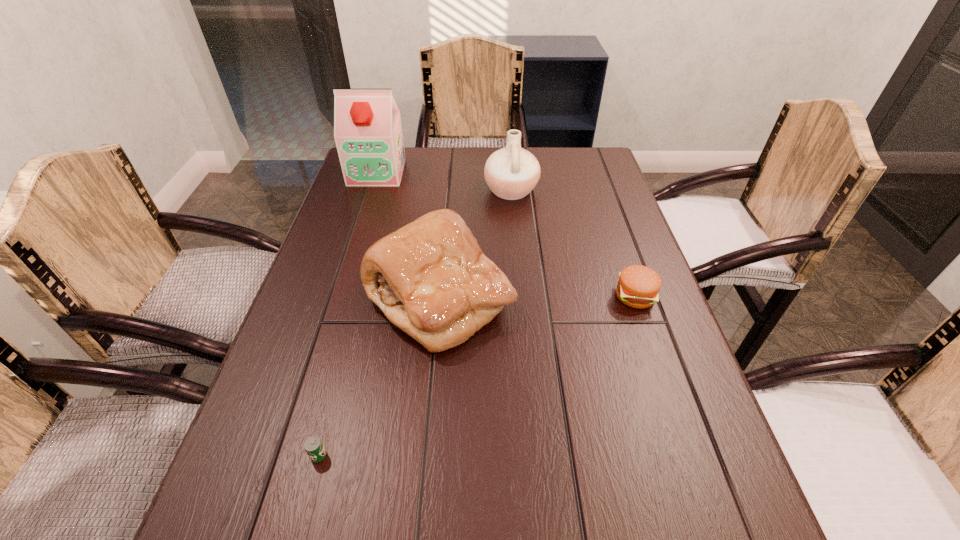
At what (x,y) coordinates should I click in order to perform the action: click on the tallest object. Please return your answer as a coordinate pair (x, y). Looking at the image, I should click on (368, 134).

What are the coordinates of `pottery` in the screenshot? It's located at (511, 173).

Locate an element on the screen. bread is located at coordinates (430, 278).

Find the location of a particular element. This screenshot has width=960, height=540. hamburger is located at coordinates (638, 286).

Find the location of a particular element. This screenshot has width=960, height=540. the fourth tallest object is located at coordinates (638, 286).

Find the location of `the nearest object`. the nearest object is located at coordinates (314, 447).

Where is `beer can`? The width and height of the screenshot is (960, 540). beer can is located at coordinates (314, 447).

The image size is (960, 540). Find the location of `blank space located 0.310m with the cap open on the soya milk`. blank space located 0.310m with the cap open on the soya milk is located at coordinates (351, 252).

The width and height of the screenshot is (960, 540). I want to click on vacant space located 0.230m to pour from the handle of the pottery, so click(x=409, y=190).

This screenshot has height=540, width=960. Identify the location of vacant region located 0.190m to pour from the handle of the pottery. (421, 190).